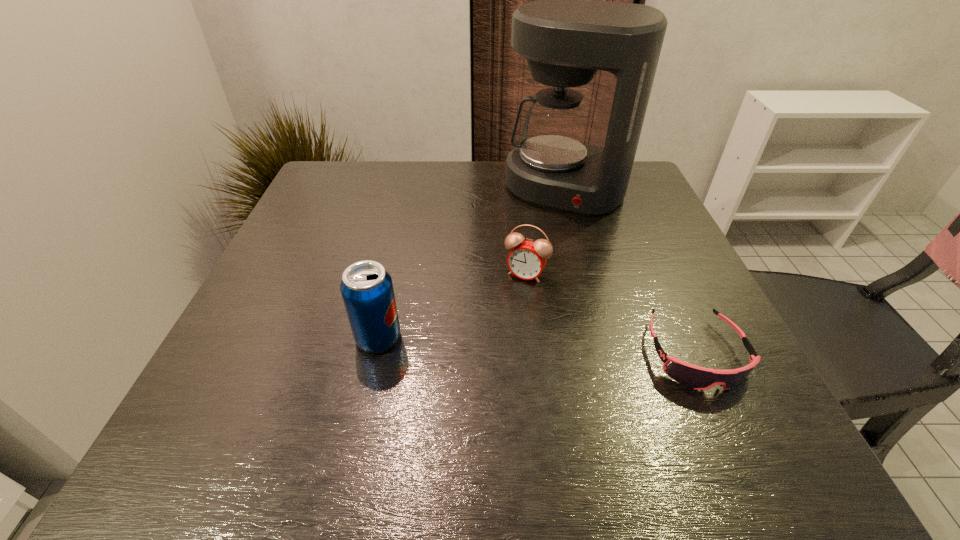
You are a GUI agent. You are given a task and a screenshot of the screen. Output one action in this format:
    pyautogui.click(x=<x>, y=<y>)
    Task: Click on the leftmost object
    
    Given the screenshot: What is the action you would take?
    pyautogui.click(x=367, y=291)

This screenshot has height=540, width=960. Identify the location of the second tallest object. (367, 291).

Locate an element on the screen. Image resolution: width=960 pixels, height=540 pixels. the shortest object is located at coordinates (698, 378).

The width and height of the screenshot is (960, 540). In order to click on the tallest object in this screenshot , I will do `click(566, 36)`.

You are a GUI agent. You are given a task and a screenshot of the screen. Output one action in this format:
    pyautogui.click(x=<x>, y=<y>)
    Task: Click on the farthest object
    
    Given the screenshot: What is the action you would take?
    pyautogui.click(x=566, y=36)

This screenshot has width=960, height=540. Identify the location of the second shortest object. (527, 259).

The image size is (960, 540). I want to click on the second farthest object, so click(x=527, y=259).

Locate an element on the screen. vacant region located on the right of the pop soda is located at coordinates (517, 338).

The height and width of the screenshot is (540, 960). Find the location of `vacant space located 0.310m on the front-facing side of the tallest object`. vacant space located 0.310m on the front-facing side of the tallest object is located at coordinates (508, 299).

Locate an element on the screen. This screenshot has width=960, height=540. free location located on the front-facing side of the tallest object is located at coordinates (530, 255).